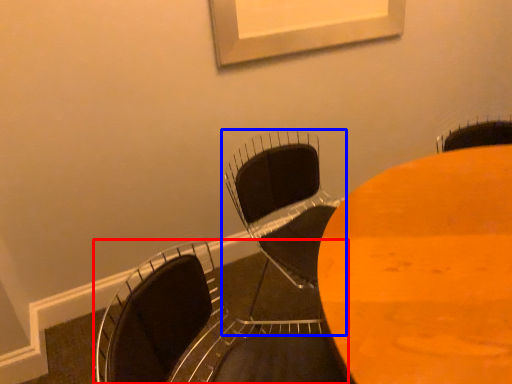
Question: Which point is further to the camera, chair (highlighted by a red box) or chair (highlighted by a blue box)?

Choices:
 (A) chair
 (B) chair

Answer: (B)